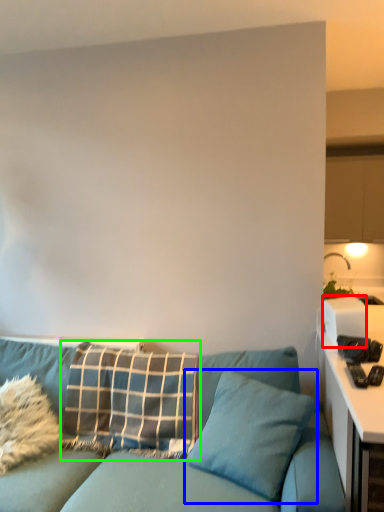
Question: Estimate the real-world distances between objects in this image. Which object is closer to appliance (highlighted by a red box), pillow (highlighted by a blue box) or pillow (highlighted by a green box)?

Choices:
 (A) pillow
 (B) pillow

Answer: (A)